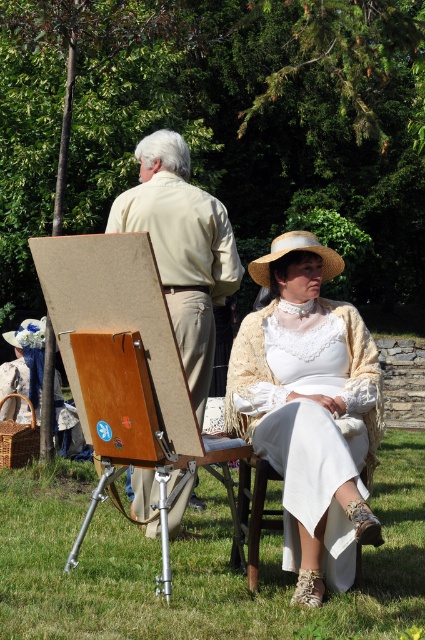
Locate an element on the screen. The height and width of the screenshot is (640, 425). wooden easel at center is located at coordinates (119, 348).

Is wooden easel at center positioned behind light beige shirt at center?

No, it is in front of light beige shirt at center.

Is point (133, 272) positioned in front of point (175, 157)?

Yes, it is.

Image resolution: width=425 pixels, height=640 pixels. I want to click on wooden easel at center, so click(119, 348).

The height and width of the screenshot is (640, 425). Identify the location of matte brown easel at center. (311, 419).

Who is positioned more to the right, matte brown easel at center or strawmaterial/texturehat at center?

strawmaterial/texturehat at center

Which is in front, point (308, 352) or point (277, 243)?

Point (308, 352) is more forward.

This screenshot has height=640, width=425. In order to click on matte brown easel at center in this screenshot , I will do `click(311, 419)`.

I want to click on matte brown easel at center, so click(311, 419).

Is point (285, 394) positioned before point (108, 224)?

Yes, it is in front of point (108, 224).

What do you see at coordinates (311, 419) in the screenshot?
I see `matte brown easel at center` at bounding box center [311, 419].

I want to click on matte brown easel at center, so click(311, 419).